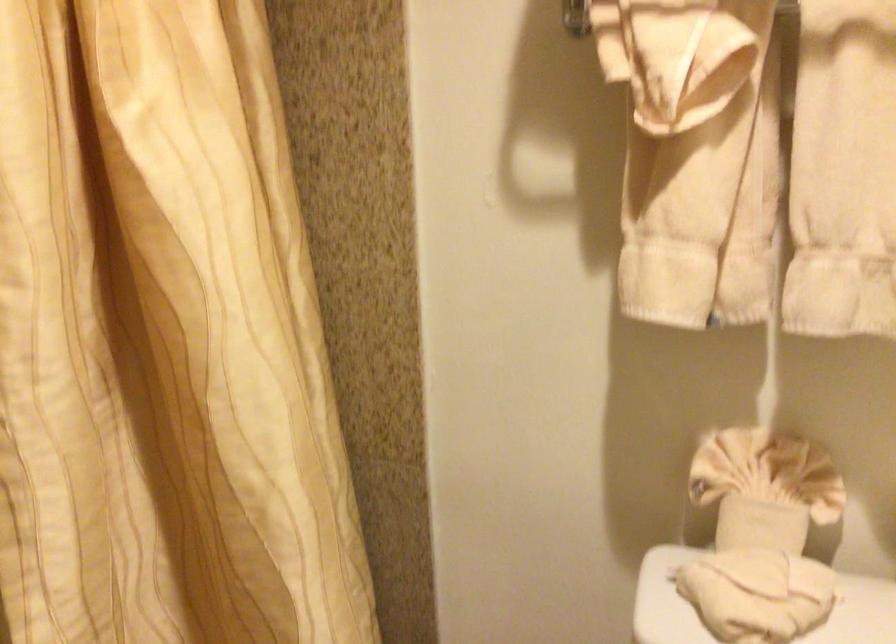
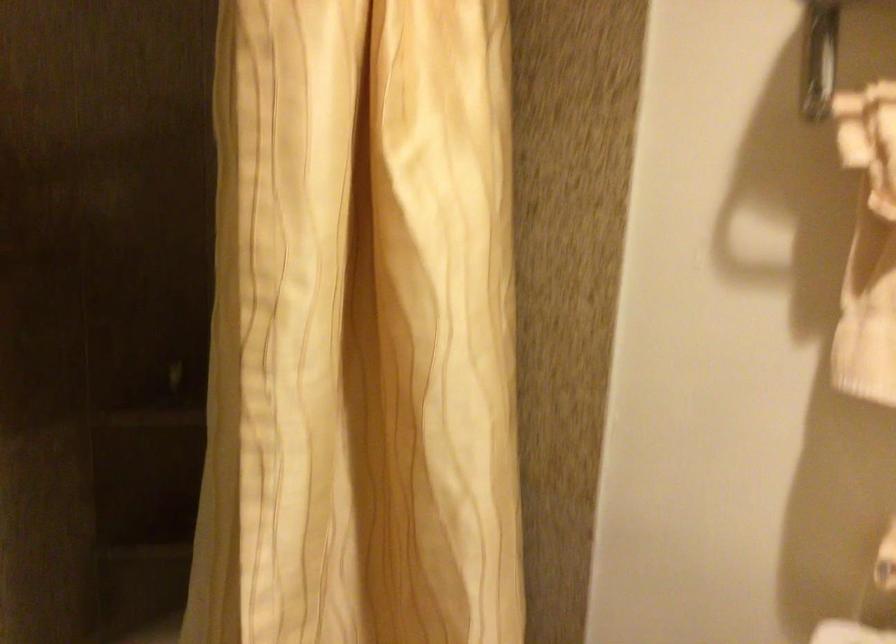
Question: The camera is either moving clockwise (left) or counter-clockwise (right) around the object. The first image is from the beginning of the video and the second image is from the end. Is the camera moving left or right when shooting the video?

Choices:
 (A) Left
 (B) Right

Answer: (B)